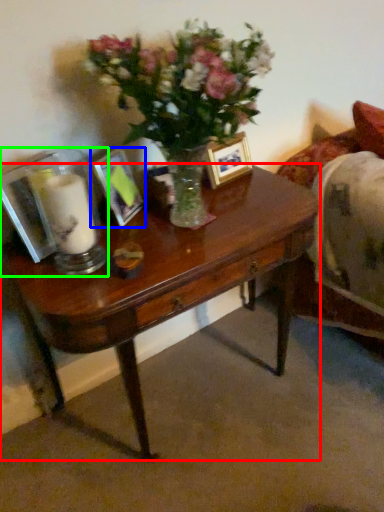
Question: Which object is the closest to the desk (highlighted by a red box)? Choose among these: picture frame (highlighted by a blue box) or tableware (highlighted by a green box).

Choices:
 (A) picture frame
 (B) tableware

Answer: (B)